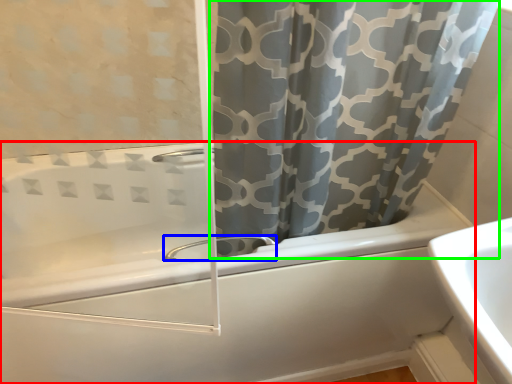
Question: Which object is positioned closest to bathtub (highlighted by a red box)? Select from tap (highlighted by a blue box) and curtain (highlighted by a green box).

Choices:
 (A) tap
 (B) curtain

Answer: (A)